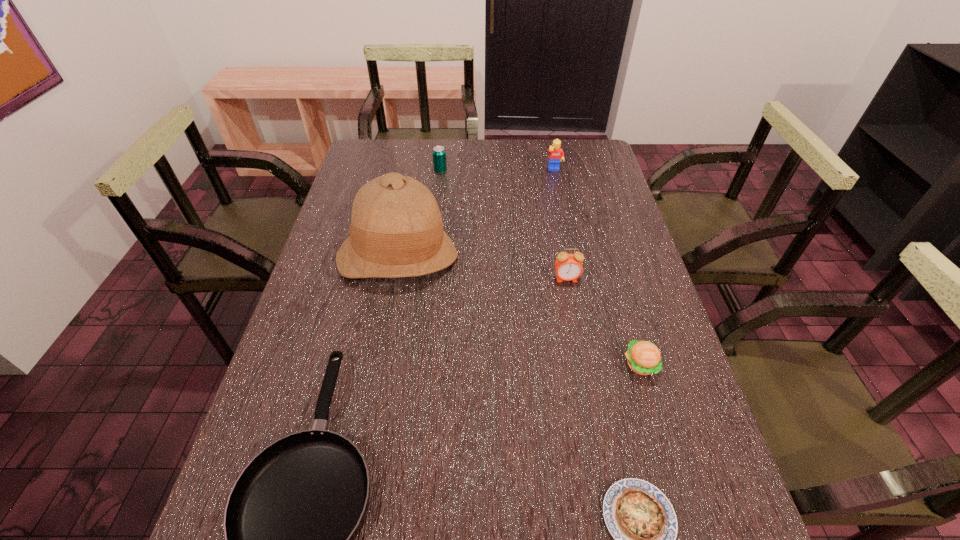
Locate an element on the screen. This screenshot has width=960, height=540. free region at the far right corner is located at coordinates (590, 152).

Where is `vacant space that's between the beer can and the fifth tallest object`? vacant space that's between the beer can and the fifth tallest object is located at coordinates (540, 268).

This screenshot has height=540, width=960. I want to click on vacant area that lies between the alarm clock and the hat, so click(x=482, y=268).

At what (x,y) coordinates should I click in order to perform the action: click on free point between the Lego and the hat. Please return your answer as a coordinate pair (x, y). This screenshot has width=960, height=540. Looking at the image, I should click on (476, 214).

Find the location of a particular element. free space between the Lego and the alarm clock is located at coordinates (561, 225).

The height and width of the screenshot is (540, 960). Find the location of `free spot between the Lego and the alarm clock`. free spot between the Lego and the alarm clock is located at coordinates (561, 225).

Where is `vacant area that lies between the fifth tallest object and the Lego`? This screenshot has width=960, height=540. vacant area that lies between the fifth tallest object and the Lego is located at coordinates (598, 267).

Find the location of a particular element. free space between the third shortest object and the Lego is located at coordinates (598, 267).

Locate which object ranks sixth in proximity to the quiche. Please provide its 2D coordinates. Your answer should be formatted as a tuple, i.e. [(x, y)], where the tuple contains the x and y coordinates of a point satisfying the conditions above.

[(439, 154)]

Find the location of a particular element. The width and height of the screenshot is (960, 540). object that is the third closest to the Lego is located at coordinates (568, 267).